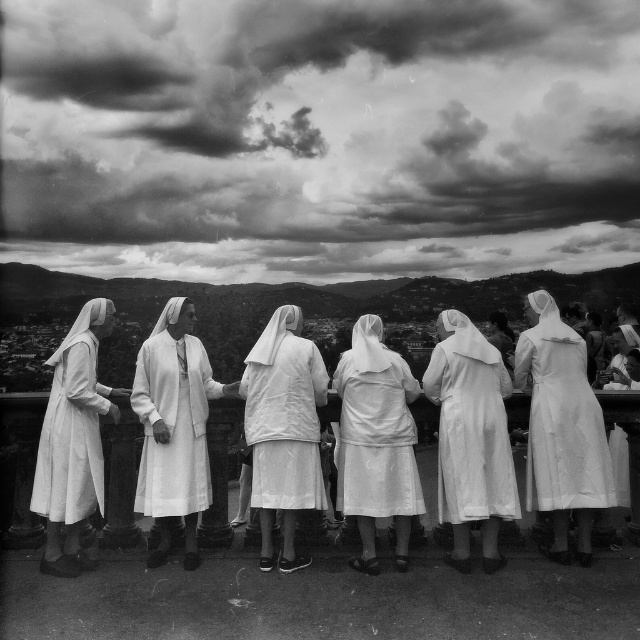
Is white matte nun's habit at center smaller than white matte dress at left?

Yes.

Based on the photo, who is more forward, (314,484) or (108,323)?

Point (314,484)

You are a GUI agent. You are given a task and a screenshot of the screen. Output one action in this format:
    pyautogui.click(x=<x>, y=<y>)
    Task: Click on the white matte nun's habit at center
    
    Given the screenshot: What is the action you would take?
    pyautogui.click(x=284, y=429)

Does white satin nun at center have a smaller size compared to white matte nun's habit at center?

Actually, white satin nun at center might be larger than white matte nun's habit at center.

Between point (433, 394) and point (262, 436), which one is positioned behind?

Point (433, 394)

The image size is (640, 640). What do you see at coordinates (470, 438) in the screenshot? I see `white satin nun at center` at bounding box center [470, 438].

I want to click on white satin nun at center, so click(x=470, y=438).

Does white matte dress at center have a lesser height compared to white satin nun's habit at center?

No.

Image resolution: width=640 pixels, height=640 pixels. I want to click on white matte dress at center, so click(561, 428).

Where is `white matte dress at center`? Image resolution: width=640 pixels, height=640 pixels. white matte dress at center is located at coordinates pos(561,428).